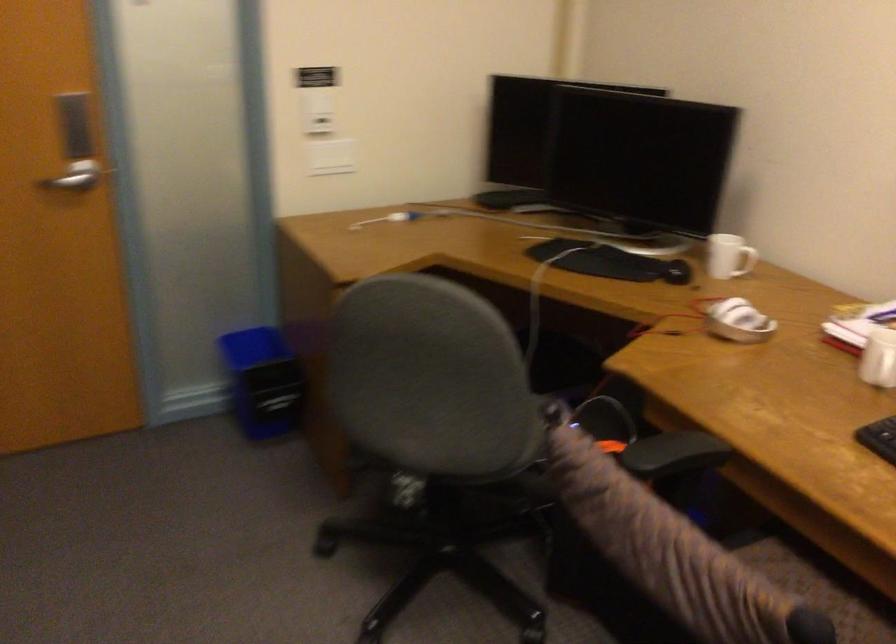
This screenshot has width=896, height=644. What do you see at coordinates (673, 453) in the screenshot?
I see `the black chair armrest` at bounding box center [673, 453].